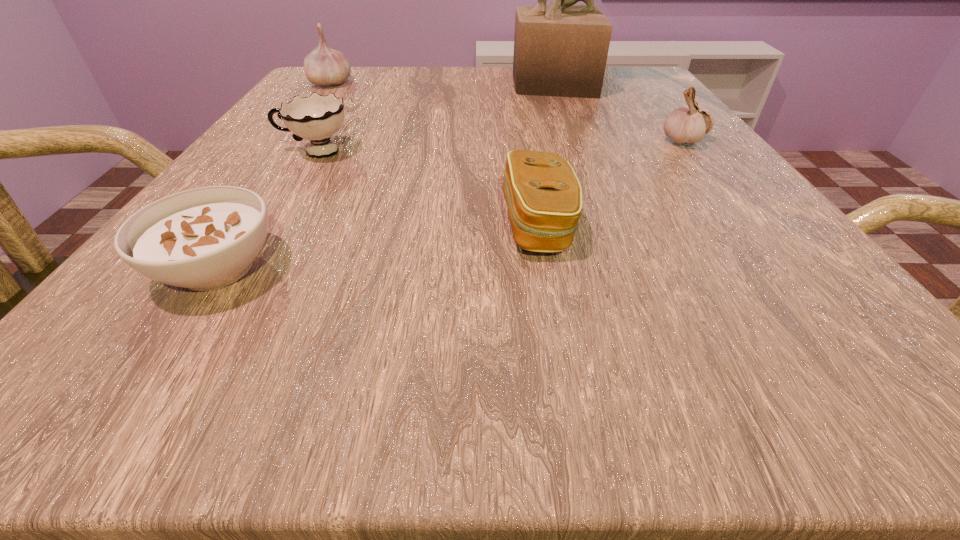
Where is `the tallest object`? This screenshot has height=540, width=960. the tallest object is located at coordinates (561, 50).

This screenshot has width=960, height=540. Identify the location of the second tallest object. click(x=324, y=66).

This screenshot has width=960, height=540. Find the location of `the farther garlic`. the farther garlic is located at coordinates (324, 66).

Identify the location of the shorter garlic. The width and height of the screenshot is (960, 540). (684, 125).

This screenshot has width=960, height=540. Identify the location of the rightmost object. (684, 125).

The width and height of the screenshot is (960, 540). Find the location of `cup`. cup is located at coordinates (316, 118).

This screenshot has width=960, height=540. I want to click on clutch bag, so click(543, 195).

Where is `soup bowl`? soup bowl is located at coordinates (202, 239).

What are the coordinates of `vacant space located on the front-facing side of the tallest object` in the screenshot? It's located at (366, 84).

This screenshot has width=960, height=540. Find the location of `blank space located 0.360m on the front-facing side of the tallest object`. blank space located 0.360m on the front-facing side of the tallest object is located at coordinates (343, 84).